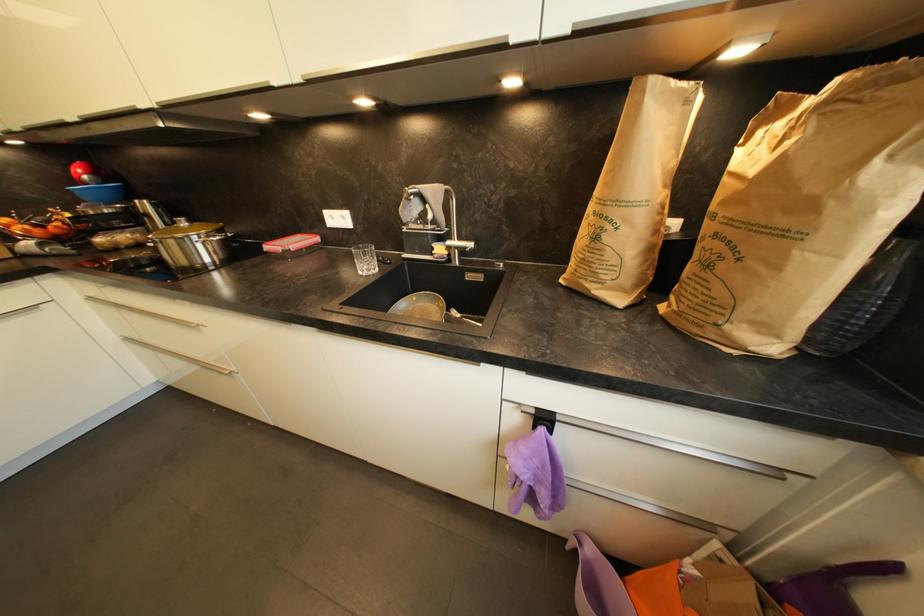
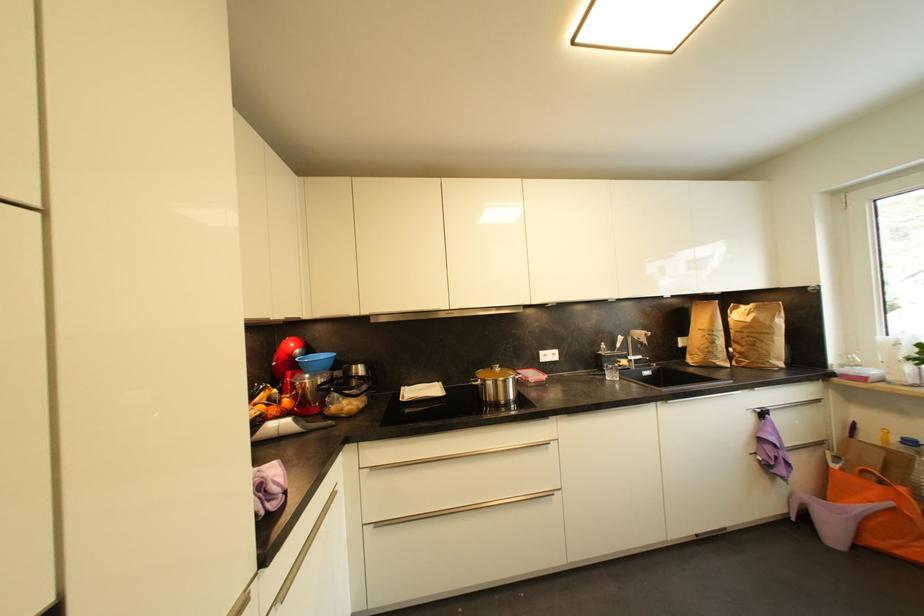
In the second image, find the point that corresponds to the point at 476,246 in the first image.

(645, 359)